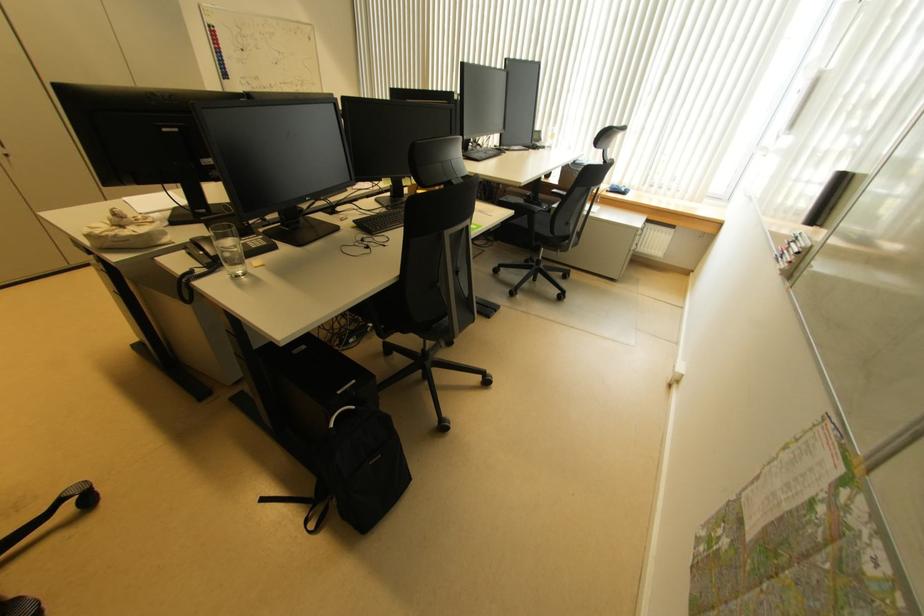
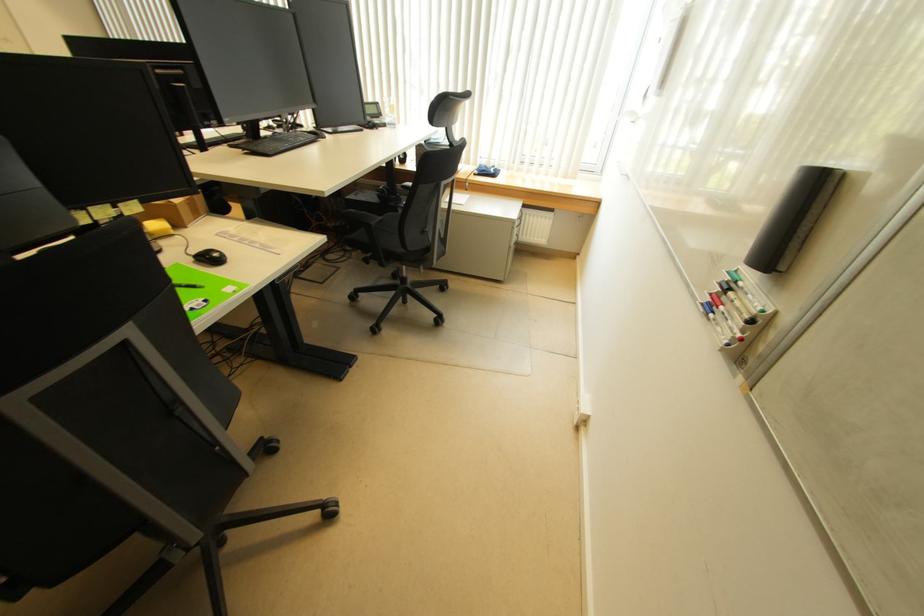
Where in the second image is the point corresponding to (569,227) from the first image?

(426, 235)